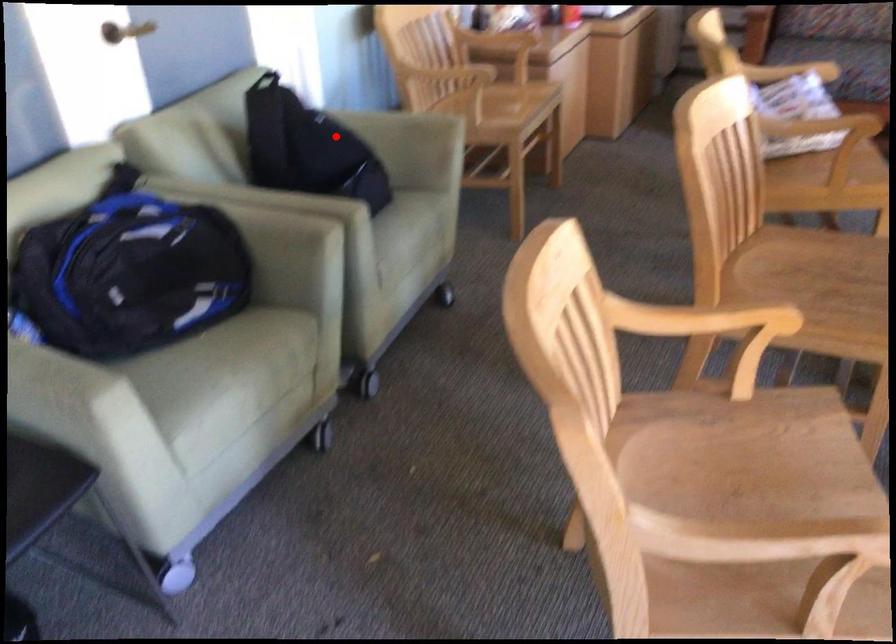
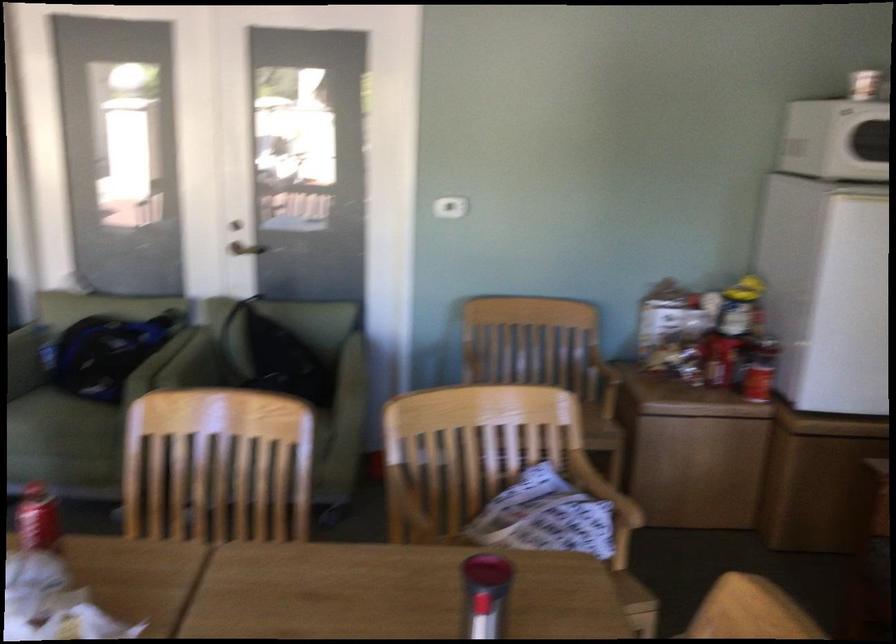
Locate, in the second image, the point that corresponds to the highlighted location in the first image.

(282, 359)